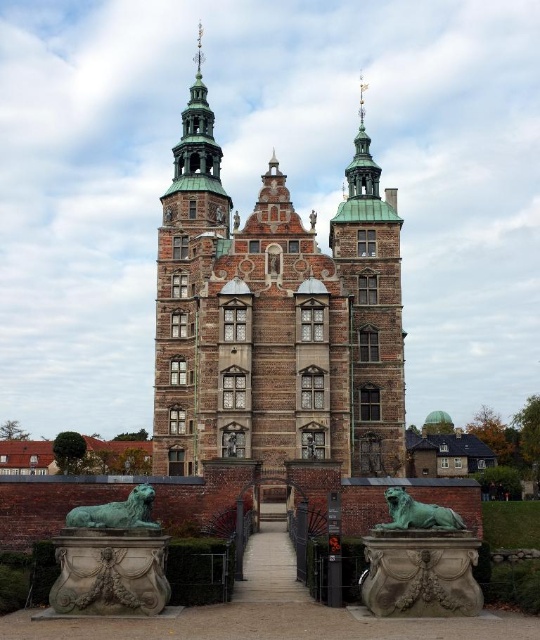
Is brown stone tower at center smaller than bronze statue at center?

Incorrect, brown stone tower at center is not smaller in size than bronze statue at center.

Is brown stone tower at center positioned in front of bronze statue at center?

That is True.

Does point (187, 209) come in front of point (228, 444)?

That is False.

Image resolution: width=540 pixels, height=640 pixels. I want to click on brown stone tower at center, so click(275, 317).

Between green patina stone lion at lower center and bronze statue at center, which one is positioned lower?

green patina stone lion at lower center is lower down.

Between green patina stone lion at lower center and bronze statue at center, which one appears on the left side from the viewer's perspective?

bronze statue at center is more to the left.

Who is more forward, (442, 509) or (238, 433)?

Point (442, 509) is in front.

Find the location of a particular element. The height and width of the screenshot is (640, 540). green patina stone lion at lower center is located at coordinates (416, 513).

Who is taller, brown stone tower at center or green patina stone lion at lower center?

brown stone tower at center

Is brown stone tower at center below green patina stone lion at lower center?

Incorrect, brown stone tower at center is not positioned below green patina stone lion at lower center.

Identify the location of brown stone tower at center. This screenshot has height=640, width=540. (275, 317).